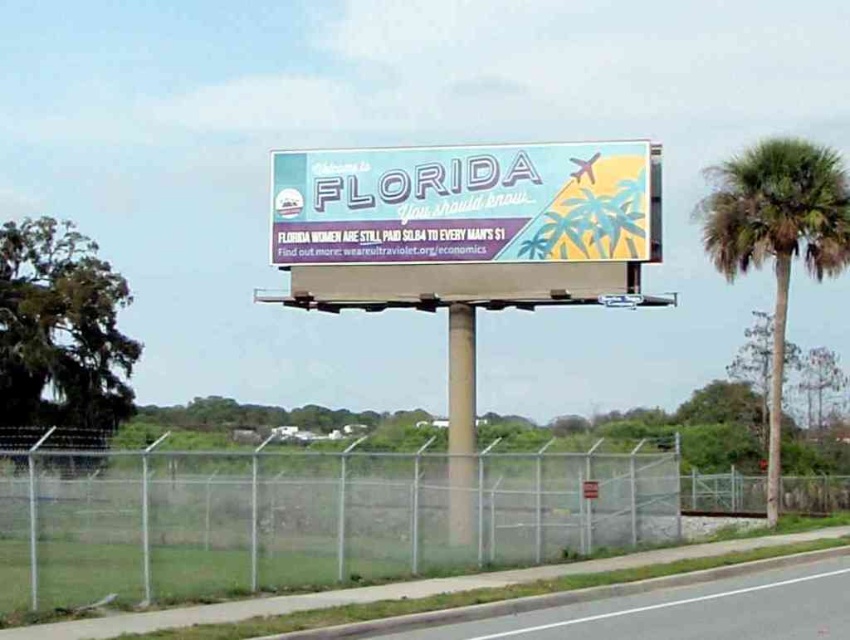
You are standing in front of the billboard and want to touch both points mentioned. Which point should you reach for first, the point at coordinate [731,266] or the point at [306,636]?

You should reach for point [731,266] first because it is closer to you than point [306,636], which is further away.